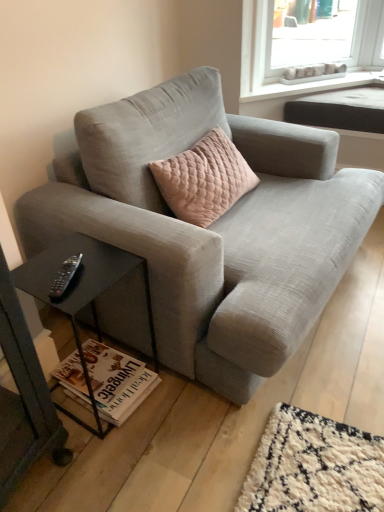
At what (x,y) coordinates should I click in order to perform the action: click on vacant space in between black glass table at lower left and light gray fabric couch at center. Please return your answer as a coordinate pair (x, y). This screenshot has height=512, width=384. Looking at the image, I should click on (164, 411).